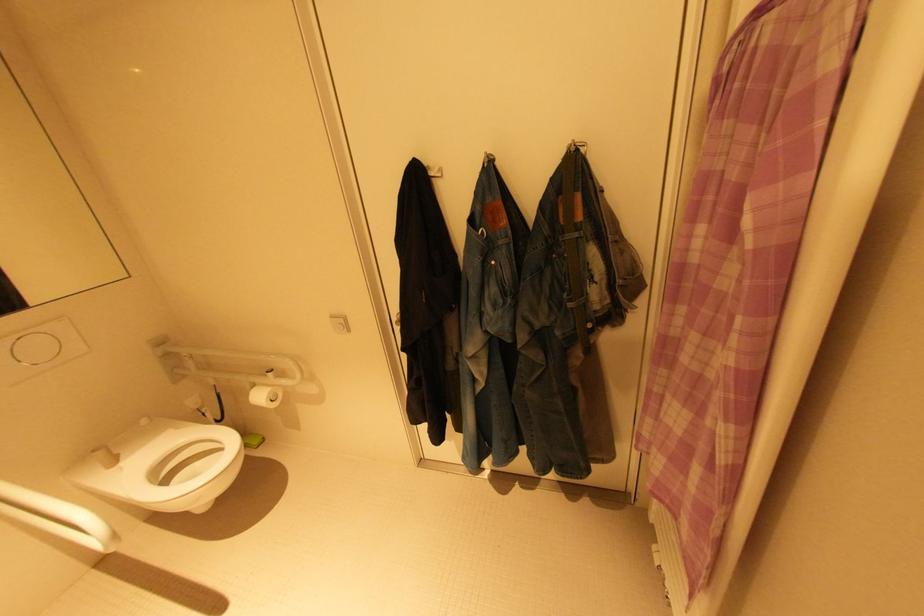
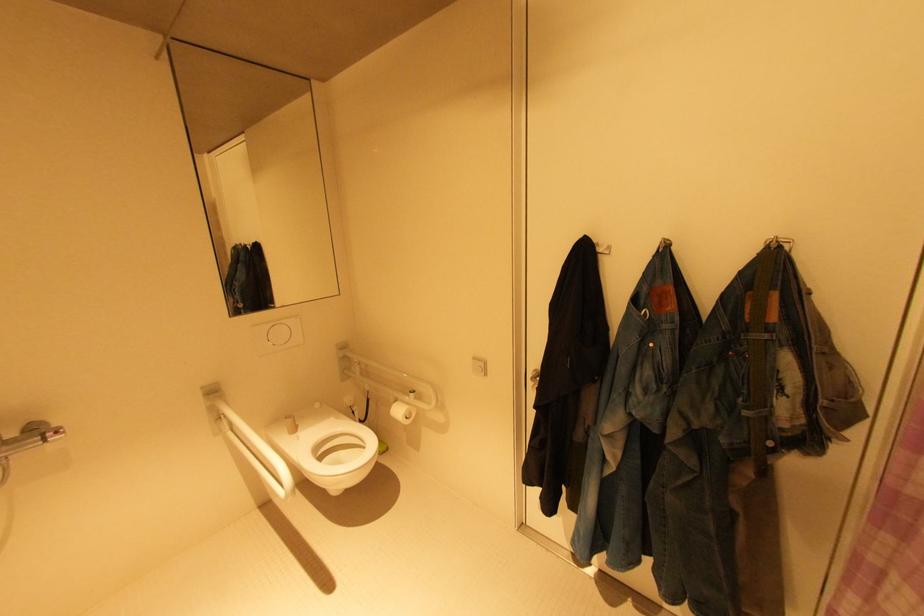
What movement of the cameraman would produce the second image?

The movement direction of the cameraman is left, backward.